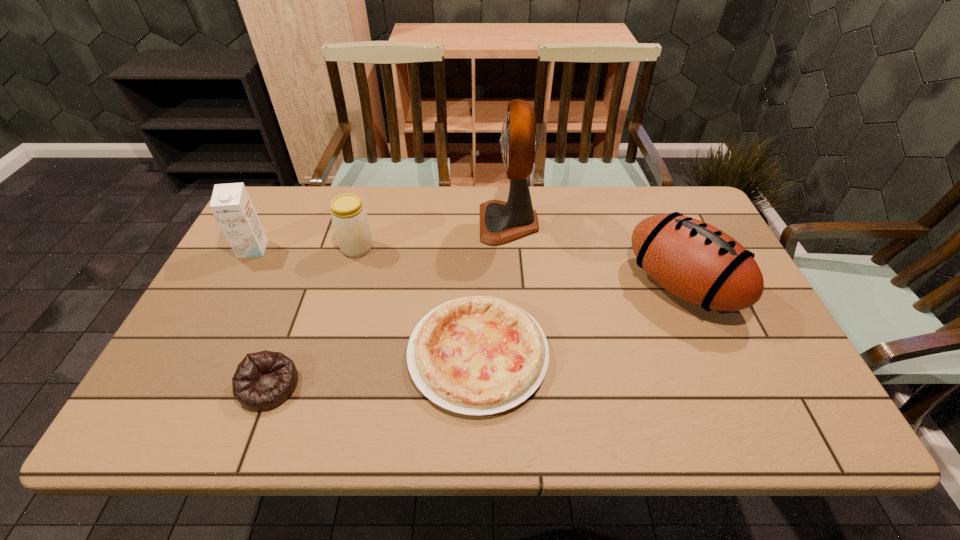
Locate an element on the screen. The height and width of the screenshot is (540, 960). vacant space at the near edge is located at coordinates (400, 411).

In the image, there is a desktop. Where is `blank space at the right edge`? blank space at the right edge is located at coordinates (748, 341).

Identify the location of vacant position at the far left corner of the desktop. The width and height of the screenshot is (960, 540). (302, 199).

Locate an element on the screen. This screenshot has height=540, width=960. vacant space at the far right corner of the desktop is located at coordinates (672, 211).

The width and height of the screenshot is (960, 540). Find the location of `vacant point located between the carton and the pizza`. vacant point located between the carton and the pizza is located at coordinates (366, 302).

The width and height of the screenshot is (960, 540). What are the coordinates of `free point between the pizza and the rightmost object` in the screenshot? It's located at (580, 320).

The height and width of the screenshot is (540, 960). Identify the location of free spot between the football (American) and the carton. (468, 267).

Identify the location of free space between the tallest object and the pizza. (493, 289).

This screenshot has width=960, height=540. I want to click on free spot between the pizza and the beanbag, so click(x=373, y=370).

Locate an element on the screen. vacant region between the third shortest object and the football (American) is located at coordinates (519, 267).